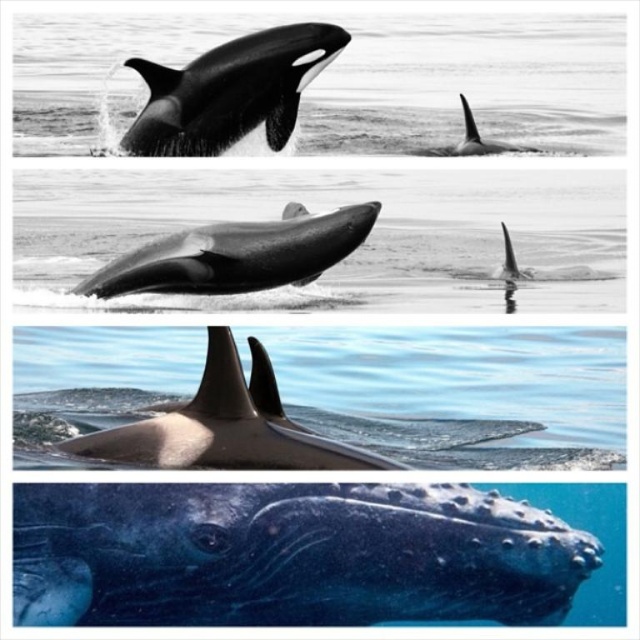
Who is higher up, black smooth orca at upper left or smooth gray dolphin at center?

black smooth orca at upper left is above.

Is black smooth orca at upper left to the left of smooth gray dolphin at center from the viewer's perspective?

Yes, black smooth orca at upper left is to the left of smooth gray dolphin at center.

Find the location of `black smooth orca at upper left`. black smooth orca at upper left is located at coordinates tap(230, 92).

Who is more forward, (269,116) or (506,147)?

Point (269,116) is in front.

Who is shorter, black smooth orca at upper left or black smooth dolphin at upper center?

With less height is black smooth dolphin at upper center.

Is point (285, 61) behind point (470, 131)?

No, (285, 61) is closer to viewer.

Identify the location of black smooth orca at upper left. (230, 92).

Does smooth gray dolphin at bottom right appear under black smooth orca at upper left?

Yes.

The width and height of the screenshot is (640, 640). Identify the location of smooth gray dolphin at bottom right. (289, 554).